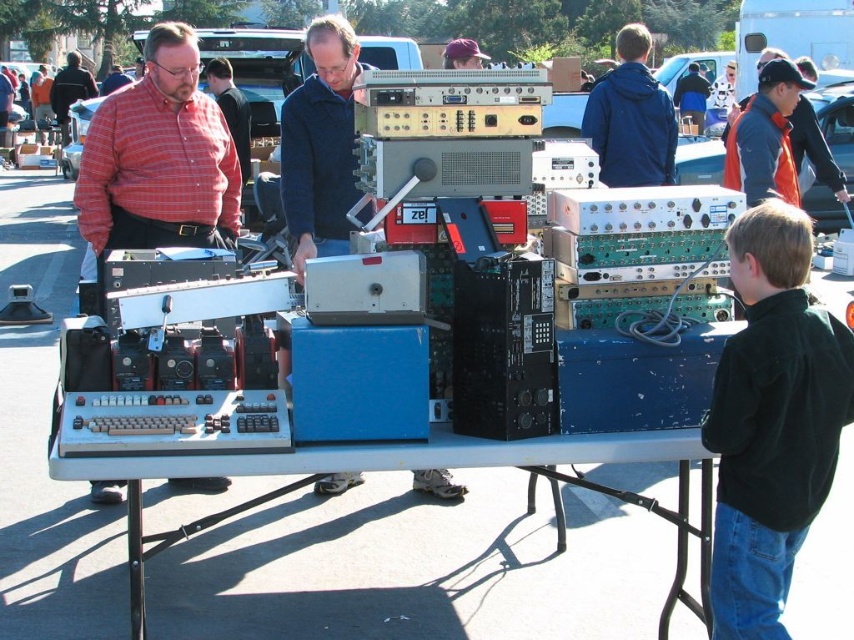
From the picture: You are a customer at the flea market looking for clothing items. You see the blue matte jacket at upper center and the matte red shirt at upper left. Which item takes up more space on the table?

The blue matte jacket at upper center takes up more space on the table because it is bigger than the matte red shirt at upper left.

You are a customer at the flea market and want to buy the matte red shirt at upper left. However, you need to first check the price tag on the white plastic table at center. Can you reach the table without moving the shirt?

The white plastic table at center is located below the matte red shirt at upper left, so you can easily reach the table without disturbing the shirt.

You are a customer at the flea market and want to buy both the white plastic table at center and the matte red shirt at upper left. However, your car trunk can only accommodate items that are narrower than 1 meter. Based on the scene, can you determine if both items will fit in your trunk?

The white plastic table at center might be wider than matte red shirt at upper left. Since the table might be wider than 1 meter, it may not fit in the trunk. The shirt is likely narrower, so it should fit. However, since the table might exceed the width limit, both items may not fit together.